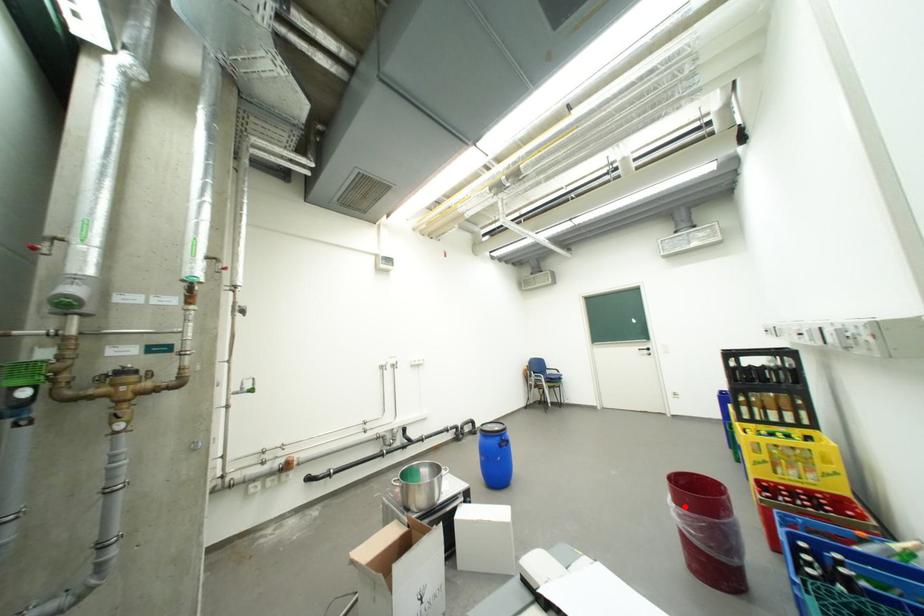
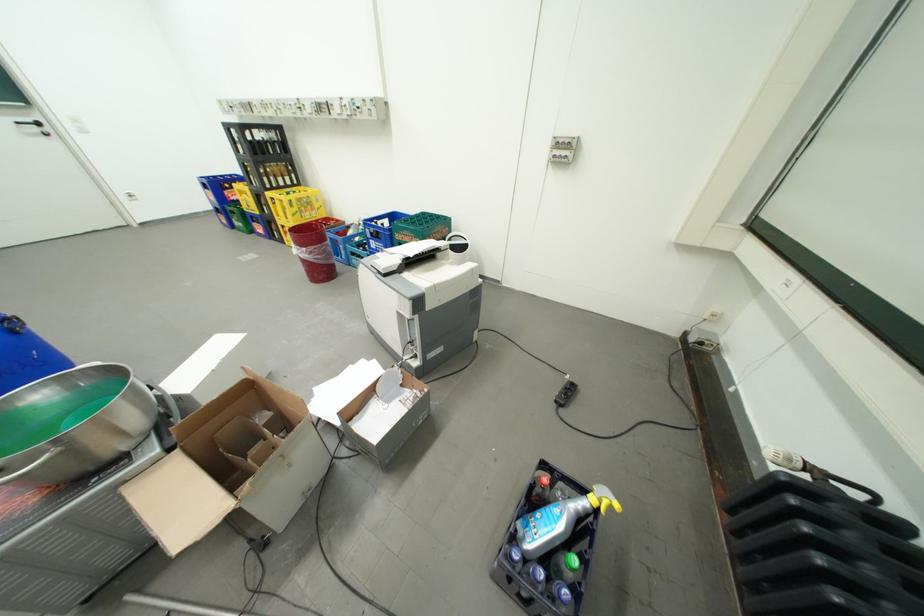
Question: I am providing you with two images of the same scene from different viewpoints. Given a red point in image1, look at the same physical point in image2. Is it:

Choices:
 (A) Closer to the viewpoint
 (B) Farther from the viewpoint

Answer: (A)